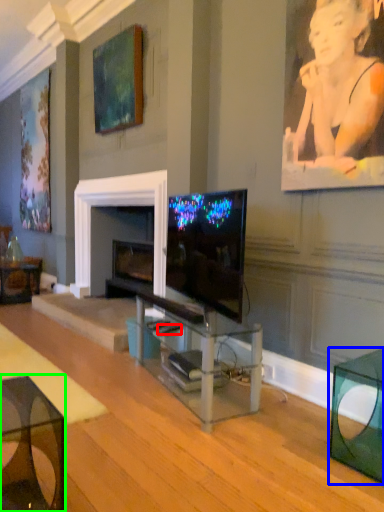
Question: Estimate the real-world distances between objects in this image. Which object is closer to remote control (highlighted by a red box), table (highlighted by a blue box) or table (highlighted by a green box)?

Choices:
 (A) table
 (B) table

Answer: (A)